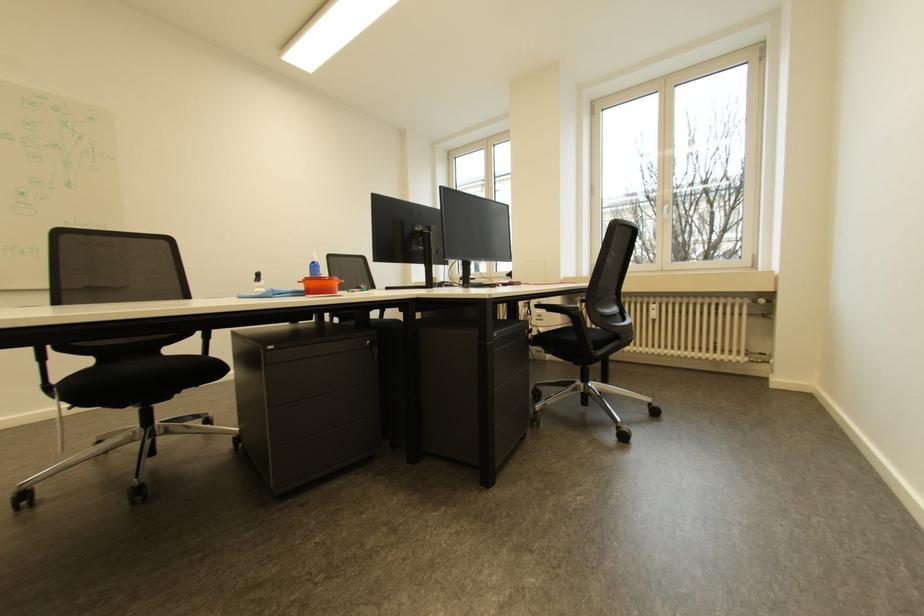
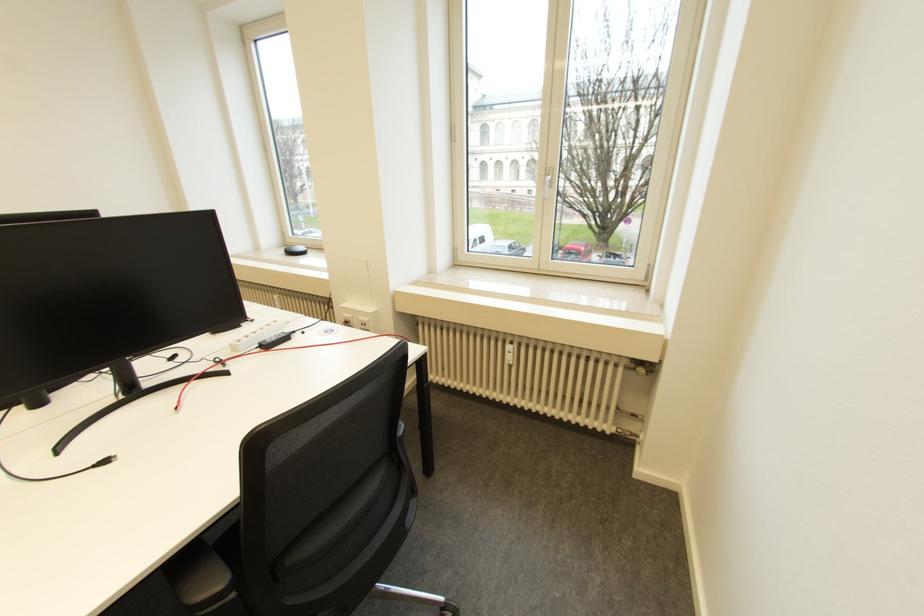
What movement of the cameraman would produce the second image?

The movement direction of the cameraman is right, forward.